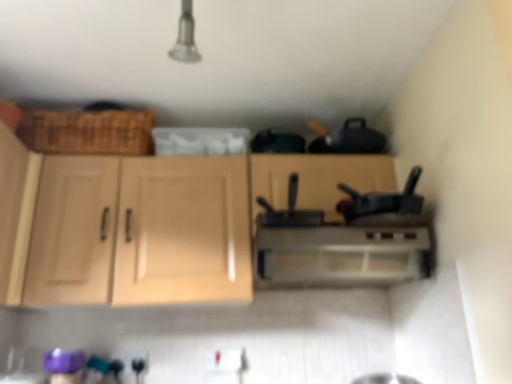
Question: Is light wood cabinet at center, positioned as the 2th cabinetry in left-to-right order, wider than satin silver range hood at center?

Choices:
 (A) yes
 (B) no

Answer: (B)

Question: Considering the relative positions of light wood cabinet at center, positioned as the 2th cabinetry in left-to-right order, and satin silver range hood at center in the image provided, is light wood cabinet at center, positioned as the 2th cabinetry in left-to-right order, to the left of satin silver range hood at center from the viewer's perspective?

Choices:
 (A) yes
 (B) no

Answer: (A)

Question: Considering the relative sizes of light wood cabinet at center, positioned as the 2th cabinetry in left-to-right order, and satin silver range hood at center in the image provided, is light wood cabinet at center, positioned as the 2th cabinetry in left-to-right order, shorter than satin silver range hood at center?

Choices:
 (A) yes
 (B) no

Answer: (B)

Question: From a real-world perspective, is light wood cabinet at center, the 1th cabinetry in the right-to-left sequence, located higher than satin silver range hood at center?

Choices:
 (A) yes
 (B) no

Answer: (A)

Question: Does light wood cabinet at center, positioned as the 2th cabinetry in left-to-right order, have a larger size compared to satin silver range hood at center?

Choices:
 (A) no
 (B) yes

Answer: (B)

Question: Is light wood cabinet at center, positioned as the 2th cabinetry in left-to-right order, positioned before satin silver range hood at center?

Choices:
 (A) no
 (B) yes

Answer: (A)

Question: Considering the relative sizes of light wood cabinet at center, positioned as the 2th cabinetry in left-to-right order, and black matte pan at center in the image provided, is light wood cabinet at center, positioned as the 2th cabinetry in left-to-right order, shorter than black matte pan at center?

Choices:
 (A) yes
 (B) no

Answer: (B)

Question: From the image's perspective, is light wood cabinet at center, the 1th cabinetry in the right-to-left sequence, located beneath black matte pan at center?

Choices:
 (A) no
 (B) yes

Answer: (B)

Question: Are light wood cabinet at center, the 1th cabinetry in the right-to-left sequence, and black matte pan at center beside each other?

Choices:
 (A) no
 (B) yes

Answer: (A)

Question: Is light wood cabinet at center, the 1th cabinetry in the right-to-left sequence, looking in the opposite direction of black matte pan at center?

Choices:
 (A) yes
 (B) no

Answer: (A)

Question: Is light wood cabinet at center, the 1th cabinetry in the right-to-left sequence, wider than black matte pan at center?

Choices:
 (A) yes
 (B) no

Answer: (B)

Question: Can you confirm if light wood cabinet at center, positioned as the 2th cabinetry in left-to-right order, is taller than black matte pan at center?

Choices:
 (A) yes
 (B) no

Answer: (A)

Question: Can you confirm if black matte pan at center is taller than light wood cabinet at center, the 1th cabinetry in the right-to-left sequence?

Choices:
 (A) yes
 (B) no

Answer: (B)